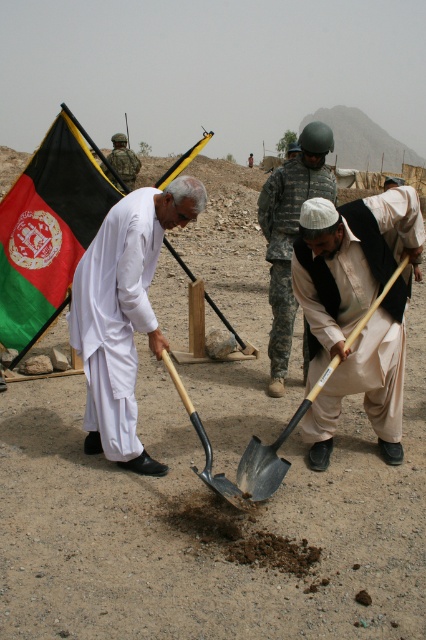
Question: Which of the following is the farthest from the observer?

Choices:
 (A) green and black fabric flag at upper left
 (B) metallic shovel at center
 (C) black metal shovel at center

Answer: (B)

Question: Does metallic shovel at center come in front of camouflage uniform at center?

Choices:
 (A) no
 (B) yes

Answer: (B)

Question: Which point appears farthest from the camera in this image?

Choices:
 (A) (247, 164)
 (B) (204, 296)
 (C) (212, 461)
 (D) (138, 300)

Answer: (A)

Question: Estimate the real-world distances between objects in this image. Which object is closer to the matte black shovel at lower right?

Choices:
 (A) wooden handle shovel at center
 (B) green and black fabric flag at upper left
 (C) camouflage uniform at upper center
 (D) white cotton shirt at center

Answer: (A)

Question: Is white matte shawl at center to the left of metallic shovel at center from the viewer's perspective?

Choices:
 (A) yes
 (B) no

Answer: (A)

Question: Does wooden handle shovel at center lie in front of metallic shovel at center?

Choices:
 (A) yes
 (B) no

Answer: (A)